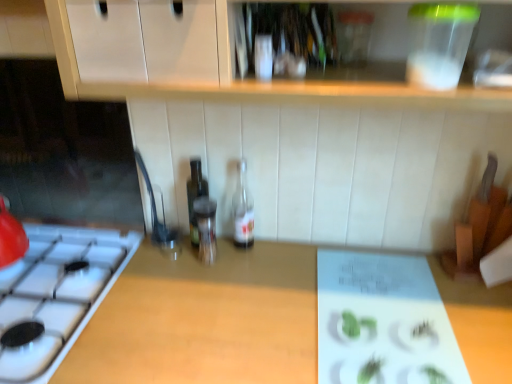
Identify the location of vacant region in front of clear glass bottle at center, acting as the 3th bottle starting from the left. (238, 279).